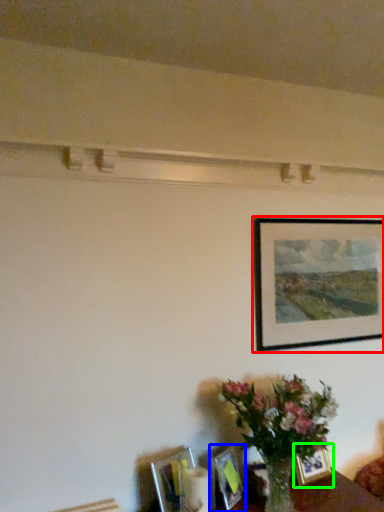
Question: Estimate the real-world distances between objects in this image. Which object is closer to picture frame (highlighted by a red box), picture frame (highlighted by a blue box) or picture frame (highlighted by a green box)?

Choices:
 (A) picture frame
 (B) picture frame

Answer: (B)